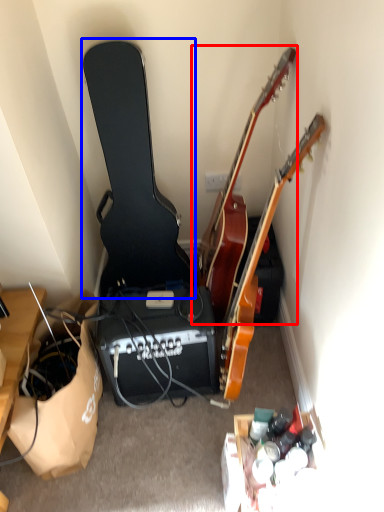
Question: Which point is further to the camera, guitar (highlighted by a red box) or guitar (highlighted by a blue box)?

Choices:
 (A) guitar
 (B) guitar

Answer: (B)